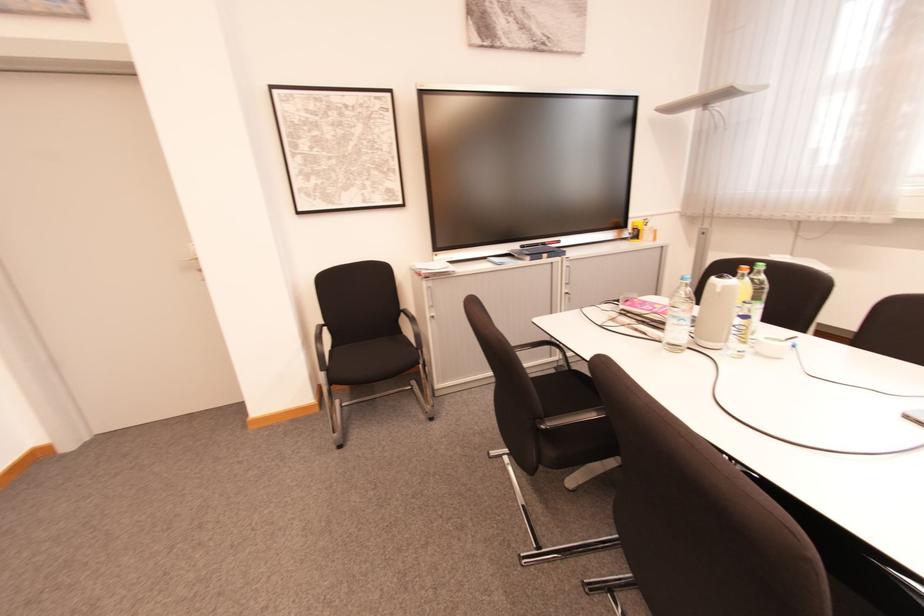
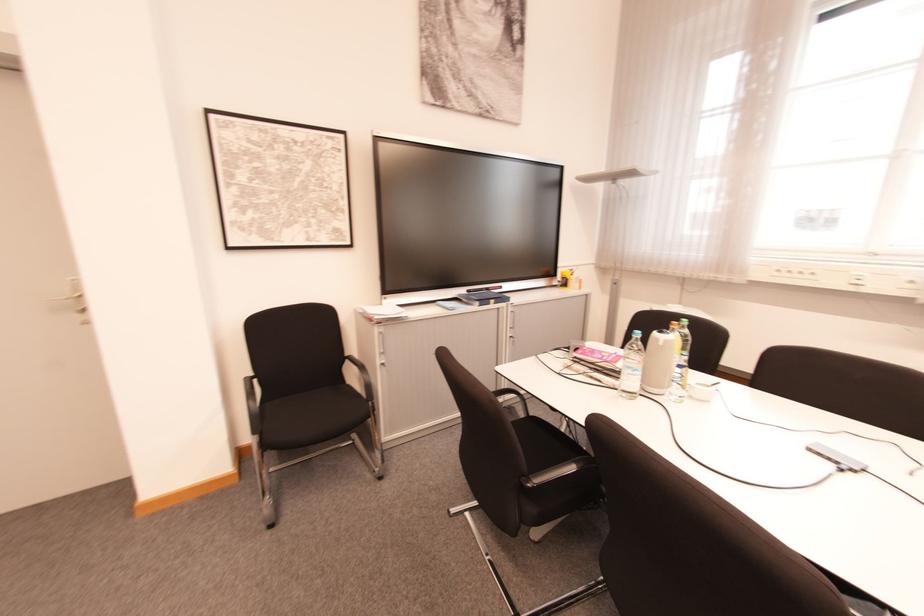
Question: Which direction would the cameraman need to move to produce the second image? Reply with the corresponding letter.

Choices:
 (A) Left
 (B) Right
 (C) Forward
 (D) Backward

Answer: (A)